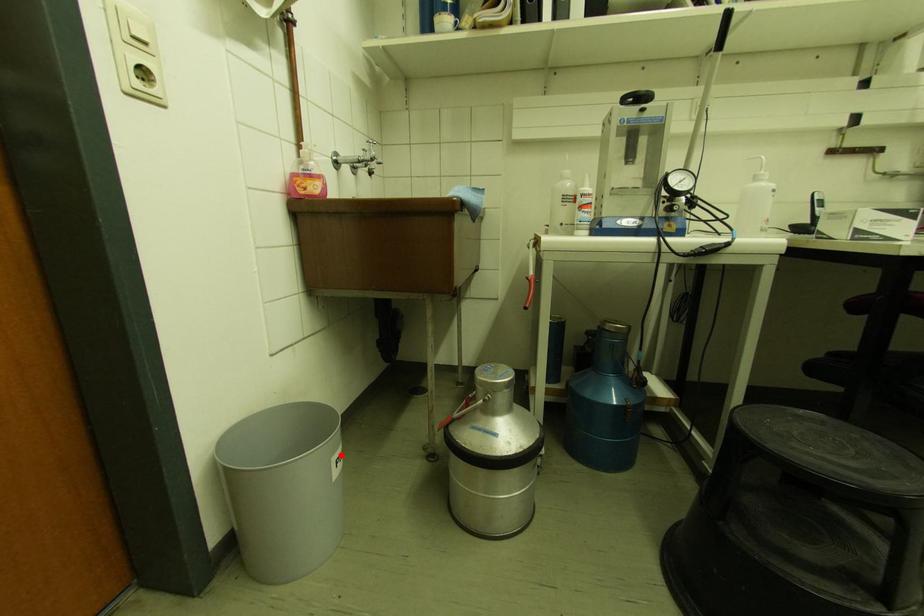
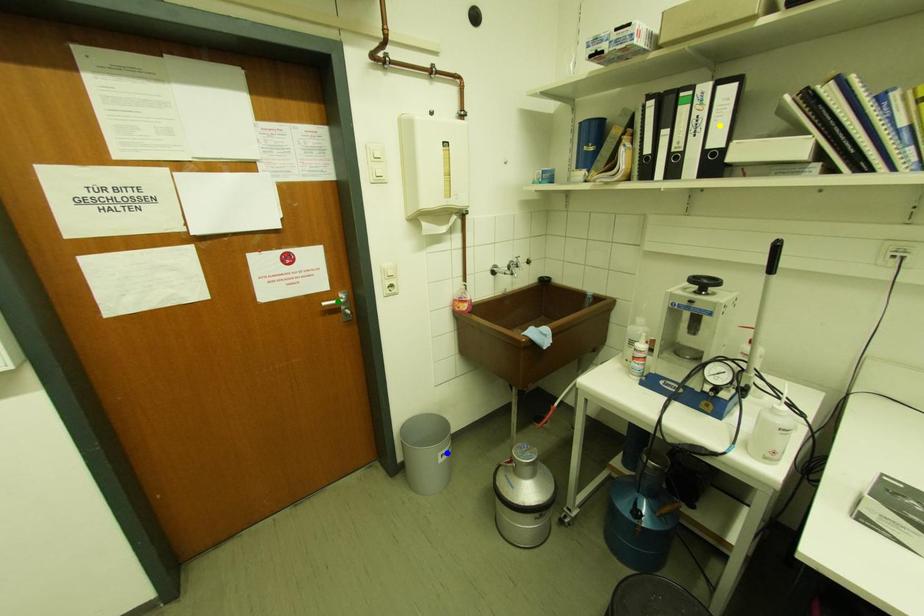
Question: I am providing you with two images of the same scene from different viewpoints. A red point is marked on the first image. You are given multiple points on the second image. Which point in image 2 represents the same 3d spot as the red point in image 1?

Choices:
 (A) yellow point
 (B) blue point
 (C) green point

Answer: (B)